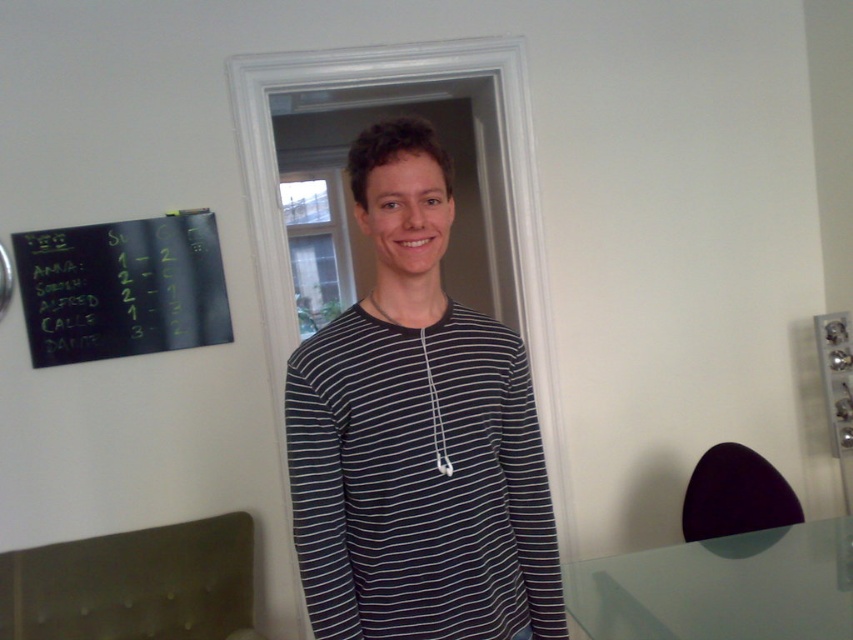
Which is more to the right, transparent glass table at lower right or black chalkboard at upper left?

transparent glass table at lower right is more to the right.

This screenshot has height=640, width=853. What are the coordinates of `transparent glass table at lower right` in the screenshot? It's located at (721, 588).

Does point (636, 624) come closer to viewer compared to point (177, 253)?

Yes, point (636, 624) is closer to viewer.

Locate an element on the screen. The height and width of the screenshot is (640, 853). transparent glass table at lower right is located at coordinates (721, 588).

Which of these two, black striped shirt at center or transparent glass table at lower right, stands shorter?

transparent glass table at lower right

Is black striped shirt at center in front of transparent glass table at lower right?

Yes, it is.

Where is `black striped shirt at center`? This screenshot has width=853, height=640. black striped shirt at center is located at coordinates (421, 483).

Who is positioned more to the left, black striped shirt at center or black chalkboard at upper left?

From the viewer's perspective, black chalkboard at upper left appears more on the left side.

Is black striped shirt at center thinner than black chalkboard at upper left?

Indeed, black striped shirt at center has a lesser width compared to black chalkboard at upper left.

I want to click on black striped shirt at center, so click(x=421, y=483).